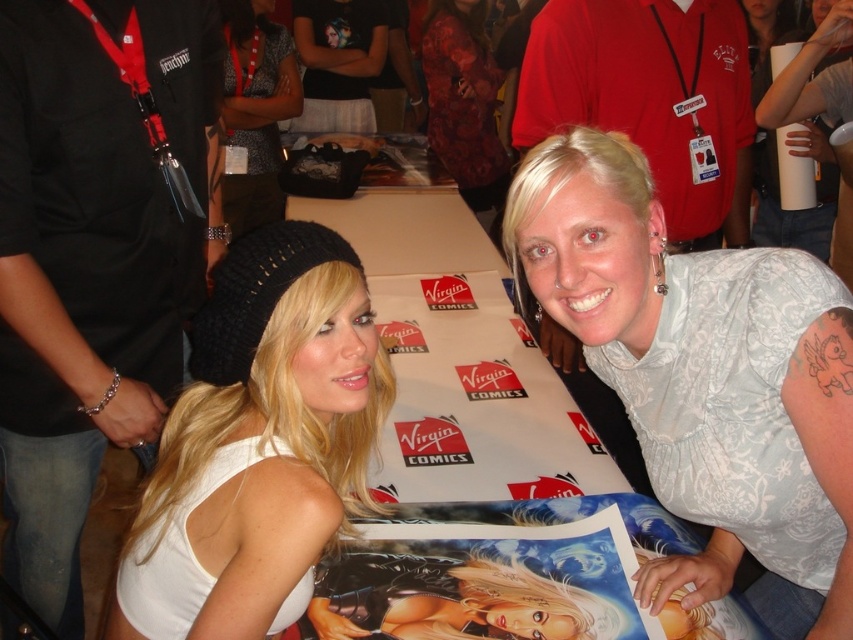
Who is more forward, (843, 580) or (285, 86)?

Point (843, 580)

At what (x,y) coordinates should I click in order to perform the action: click on white lace blouse at center. Please return your answer as a coordinate pair (x, y). Looking at the image, I should click on (703, 372).

Image resolution: width=853 pixels, height=640 pixels. What do you see at coordinates (703, 372) in the screenshot?
I see `white lace blouse at center` at bounding box center [703, 372].

Image resolution: width=853 pixels, height=640 pixels. I want to click on white lace blouse at center, so click(703, 372).

Is point (280, 374) closer to camera compared to point (502, 164)?

Yes, it is.

Is white knit beanie at upper left closer to camera compared to floral fabric dress at center?

That is True.

The image size is (853, 640). Describe the element at coordinates (262, 433) in the screenshot. I see `white knit beanie at upper left` at that location.

I want to click on white knit beanie at upper left, so click(262, 433).

Which is behind, point (576, 323) or point (309, 449)?

Point (309, 449)

Which is in front, point (788, 369) or point (164, 460)?

Point (788, 369) is in front.

Identify the location of white lace blouse at center. This screenshot has width=853, height=640. (703, 372).